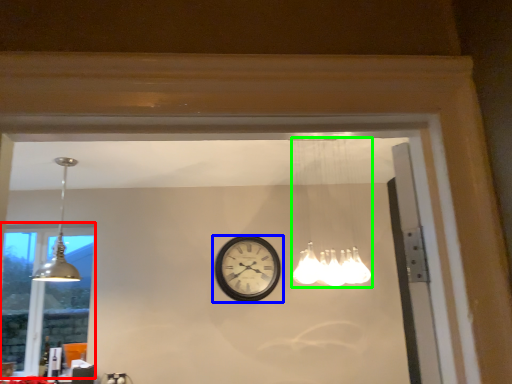
Question: Based on their relative distances, which object is nearer to window (highlighted by a red box)? Choose from wall clock (highlighted by a blue box) and lamp (highlighted by a green box).

Choices:
 (A) wall clock
 (B) lamp

Answer: (A)